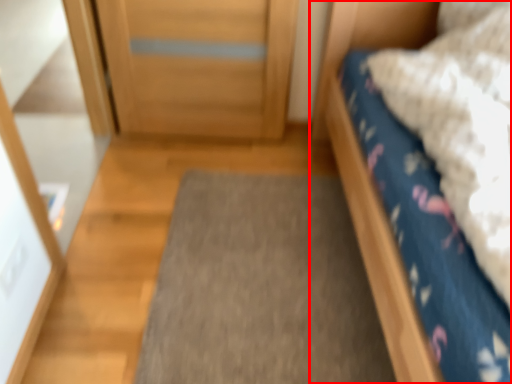
Question: Where is bed (annotated by the red box) located in relation to doormat in the image?

Choices:
 (A) left
 (B) right

Answer: (B)